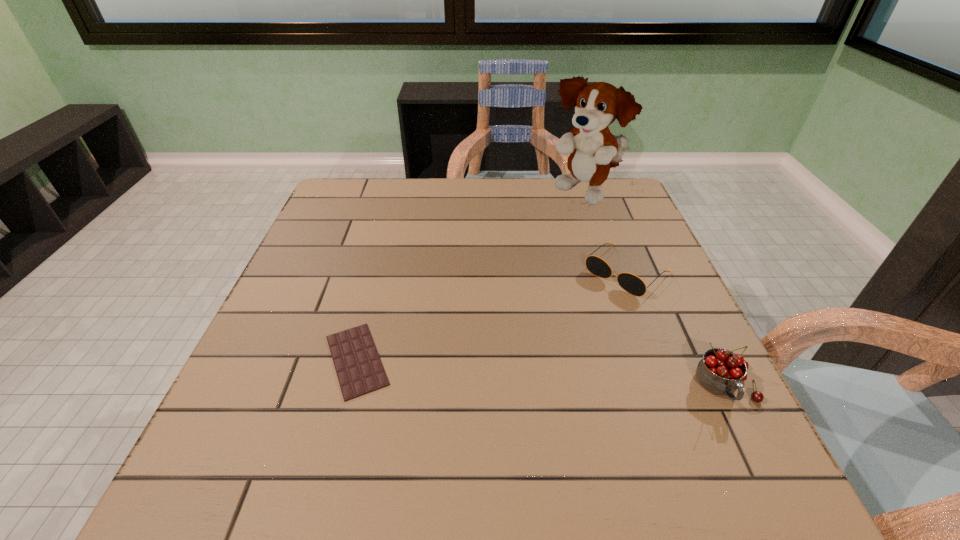
At what (x,y) coordinates should I click in order to perform the action: click on the shortest object. Please return your answer as a coordinate pair (x, y). This screenshot has height=540, width=960. Looking at the image, I should click on (359, 369).

Where is `the leftmost object`? the leftmost object is located at coordinates (359, 369).

Identify the location of pot filled with cherries. The width and height of the screenshot is (960, 540). (721, 372).

Find the location of a particular element. Image resolution: width=960 pixels, height=540 pixels. the farthest object is located at coordinates (598, 105).

Locate an element on the screen. Image resolution: width=960 pixels, height=540 pixels. puppy is located at coordinates (598, 105).

At what (x,y) coordinates should I click in order to perform the action: click on the third nearest object. Please return your answer as a coordinate pair (x, y). Image resolution: width=960 pixels, height=540 pixels. Looking at the image, I should click on (631, 283).

At what (x,y) coordinates should I click in order to perform the action: click on the second shortest object. Please return your answer as a coordinate pair (x, y). The height and width of the screenshot is (540, 960). Looking at the image, I should click on (631, 283).

The image size is (960, 540). Identify the location of free space located 0.300m on the back of the chocolate bar. (388, 240).

Find the location of `free region located on the face of the puppy`. free region located on the face of the puppy is located at coordinates (531, 295).

Find the location of a particular element. vacant space located on the face of the puppy is located at coordinates (560, 240).